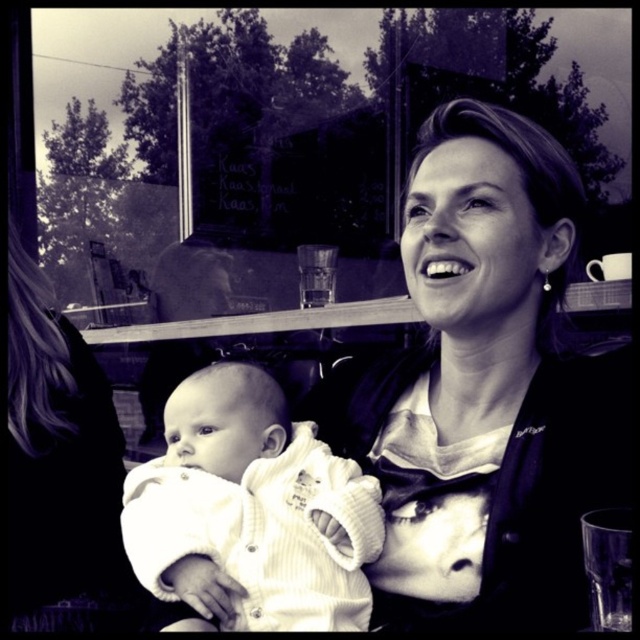
Can you confirm if matte black jacket at center is shorter than white soft baby at center?

Yes.

Is point (390, 440) in front of point (54, 378)?

Yes, it is.

The image size is (640, 640). I want to click on matte black jacket at center, so click(484, 390).

The height and width of the screenshot is (640, 640). Identify the location of matte black jacket at center. (484, 390).

Can you confirm if white corduroy baby at center is wider than white soft baby at center?

Correct, the width of white corduroy baby at center exceeds that of white soft baby at center.

Measure the distance between point (244,380) and camera.

Point (244,380) and camera are 3.31 feet apart.

I want to click on white corduroy baby at center, so click(x=252, y=512).

Does point (419, 262) come closer to viewer compared to point (196, 472)?

That is True.

Who is higher up, matte black jacket at center or white corduroy baby at center?

matte black jacket at center is above.

This screenshot has width=640, height=640. What do you see at coordinates (484, 390) in the screenshot?
I see `matte black jacket at center` at bounding box center [484, 390].

Where is `matte black jacket at center`? The image size is (640, 640). matte black jacket at center is located at coordinates (484, 390).